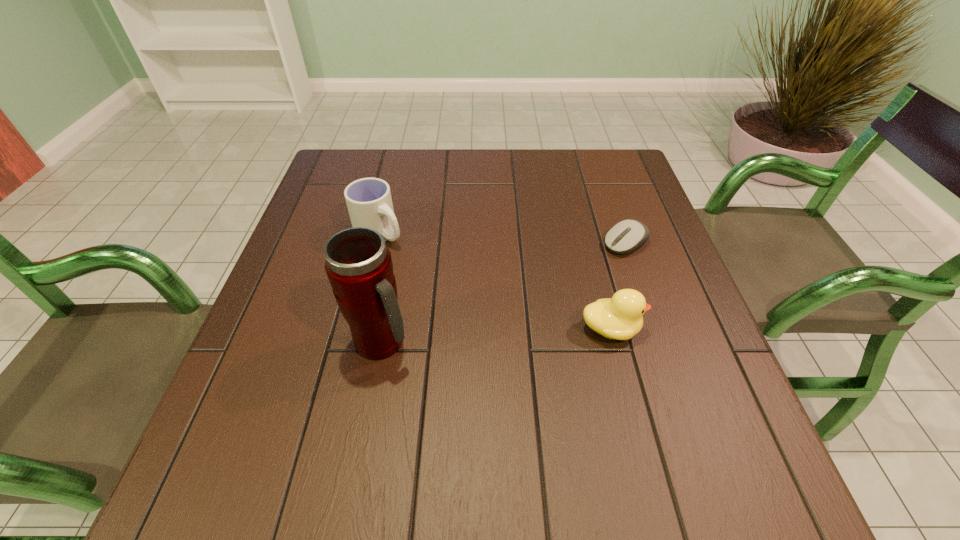
Where is `free space located 0.180m on the wheel side of the shortest object`? This screenshot has width=960, height=540. free space located 0.180m on the wheel side of the shortest object is located at coordinates point(556,286).

Identify the location of vacant area situated 0.160m on the wheel side of the shortest object. Image resolution: width=960 pixels, height=540 pixels. (563, 282).

Identify the location of object present at the left edge. This screenshot has width=960, height=540. (369, 202).

Identify the location of duckling present at the right edge. This screenshot has width=960, height=540. (621, 317).

I want to click on computer equipment that is at the right edge, so click(627, 235).

Find the location of `vacant space at the far edge of the desktop`. vacant space at the far edge of the desktop is located at coordinates (559, 182).

Locate an element on the screen. The width and height of the screenshot is (960, 540). vacant space at the near edge of the desktop is located at coordinates (377, 417).

Identify the location of blank space at the left edge. (270, 332).

The image size is (960, 540). In the image, there is a desktop. What are the coordinates of `vacant region at the near left corner` in the screenshot? It's located at coord(266,424).

Where is `vacant space at the far right corner`? Image resolution: width=960 pixels, height=540 pixels. vacant space at the far right corner is located at coordinates (626, 167).